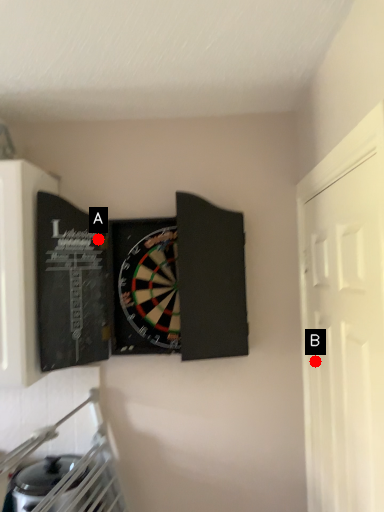
Question: Two points are circled on the image, labeled by A and B beside each circle. Among these points, which one is nearest to the camera?

Choices:
 (A) A is closer
 (B) B is closer

Answer: (B)